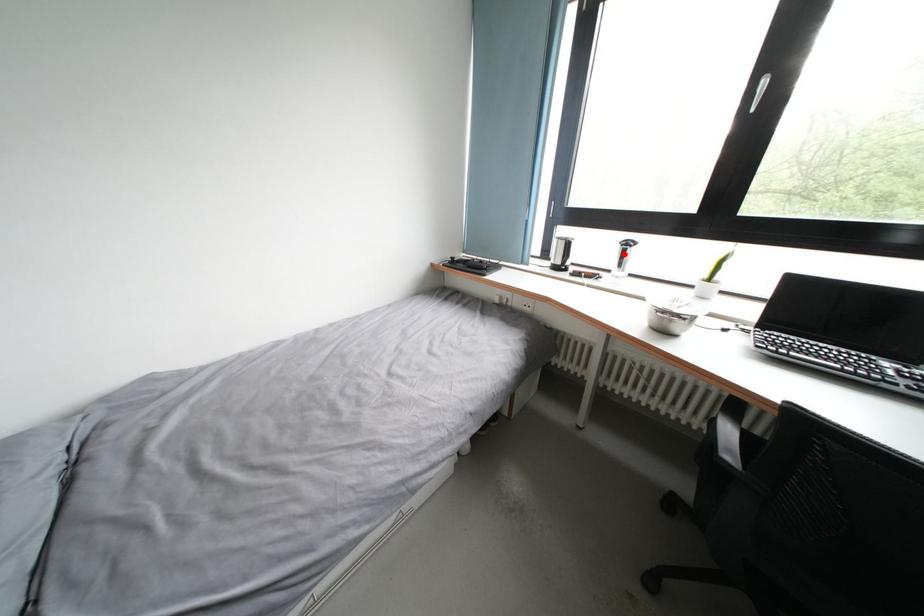
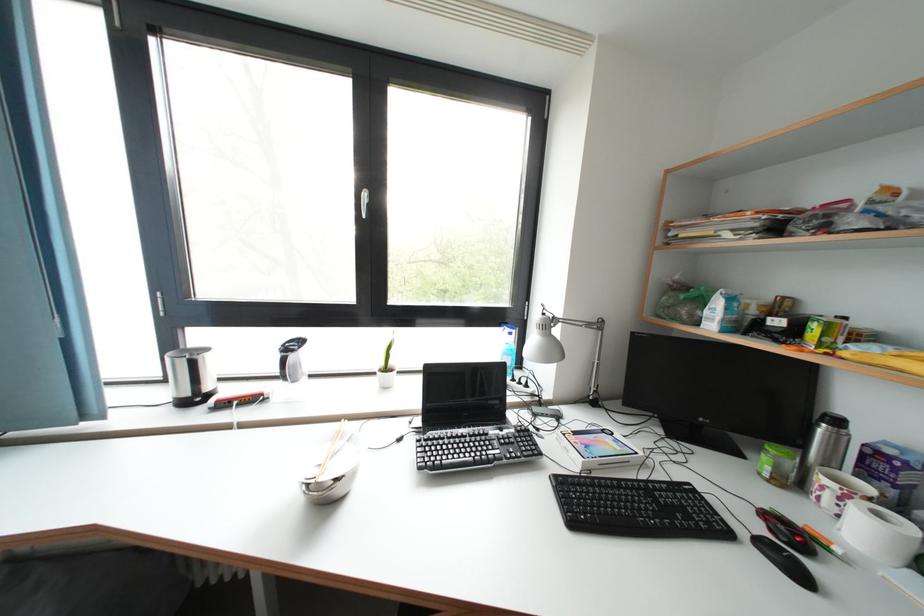
Where in the second image is the point corresponding to the highlighted location from the first image?

(285, 362)